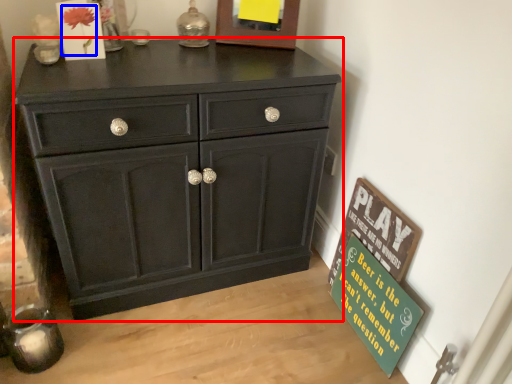
Question: Which of the following is the closest to the observer, chest of drawers (highlighted by a red box) or flower (highlighted by a blue box)?

Choices:
 (A) chest of drawers
 (B) flower

Answer: (A)